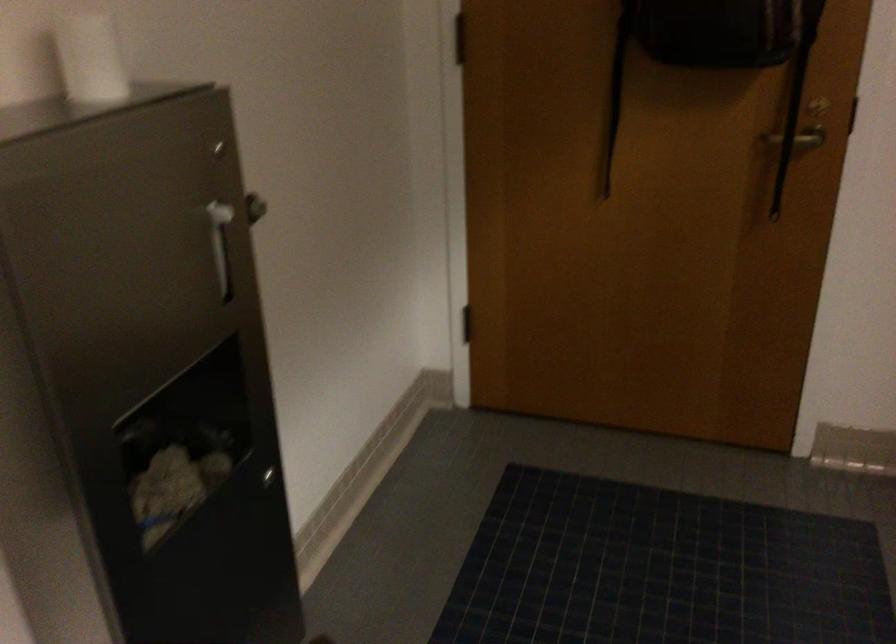
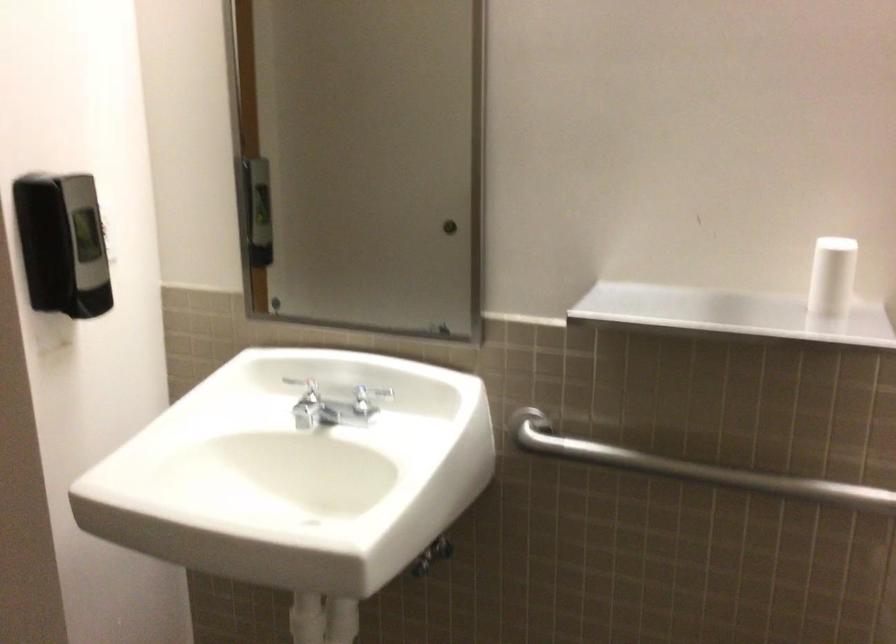
Question: Based on the continuous images, in which direction is the camera rotating? Reply with the corresponding letter.

Choices:
 (A) Left
 (B) Right
 (C) Up
 (D) Down

Answer: (B)